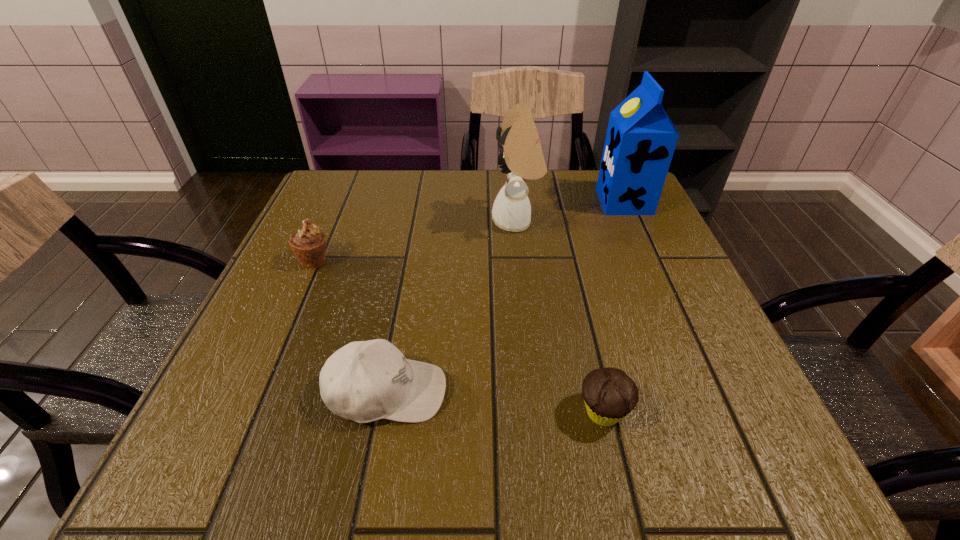
I want to click on vacant region between the baseball cap and the doll, so click(452, 307).

Identify the location of free space between the fourth object from right to left and the third object from left to right. (452, 307).

The image size is (960, 540). What are the coordinates of `unoccupied area between the shorter muffin and the third object from right to left` in the screenshot? It's located at (560, 316).

Find the location of a particular element. Image resolution: width=960 pixels, height=540 pixels. free space between the baseball cap and the shortest object is located at coordinates (495, 402).

Where is `free space between the third object from right to left and the baseball cap`? free space between the third object from right to left and the baseball cap is located at coordinates (452, 307).

Identify the location of free space between the fourth object from right to left and the rightmost object. The height and width of the screenshot is (540, 960). (506, 297).

The width and height of the screenshot is (960, 540). What are the coordinates of `vacant area that lies between the farther muffin and the rightmost object` in the screenshot? It's located at (469, 231).

The width and height of the screenshot is (960, 540). I want to click on vacant space that's between the right muffin and the rightmost object, so click(613, 307).

Find the location of `free space between the right muffin and the rightmost object`. free space between the right muffin and the rightmost object is located at coordinates (613, 307).

You are a GUI agent. You are given a task and a screenshot of the screen. Output one action in this format:
    pyautogui.click(x=<x>, y=<y>)
    Task: Click on the third closest object to the baseball cap
    Image resolution: width=960 pixels, height=540 pixels.
    Given the screenshot: What is the action you would take?
    pyautogui.click(x=521, y=157)